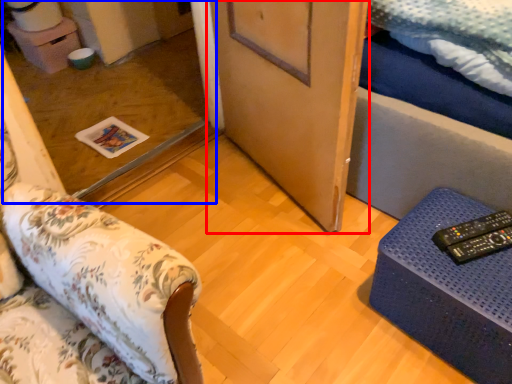
Question: Which of the following is the farthest to the observer, door (highlighted by a red box) or glass door (highlighted by a blue box)?

Choices:
 (A) door
 (B) glass door

Answer: (B)